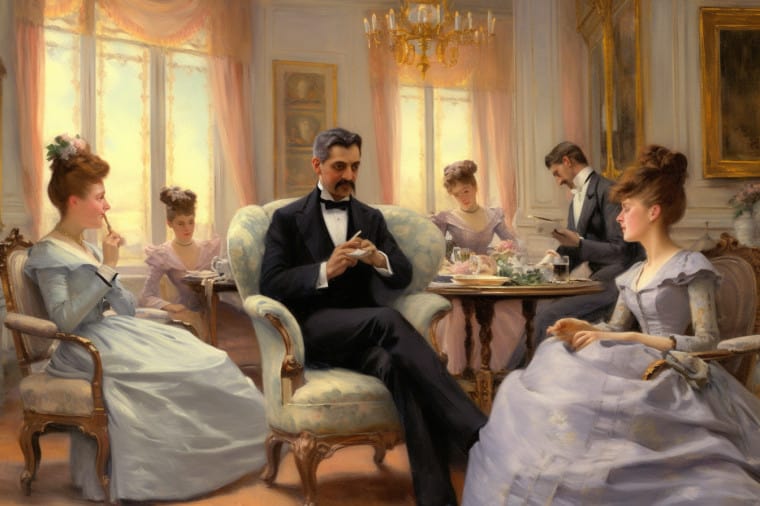
At what (x,y) coordinates should I click in order to perform the action: click on windows. Please return your answer as a coordinate pair (x, y). This screenshot has height=506, width=760. Looking at the image, I should click on (135, 92), (172, 101), (61, 74), (451, 106), (416, 107).